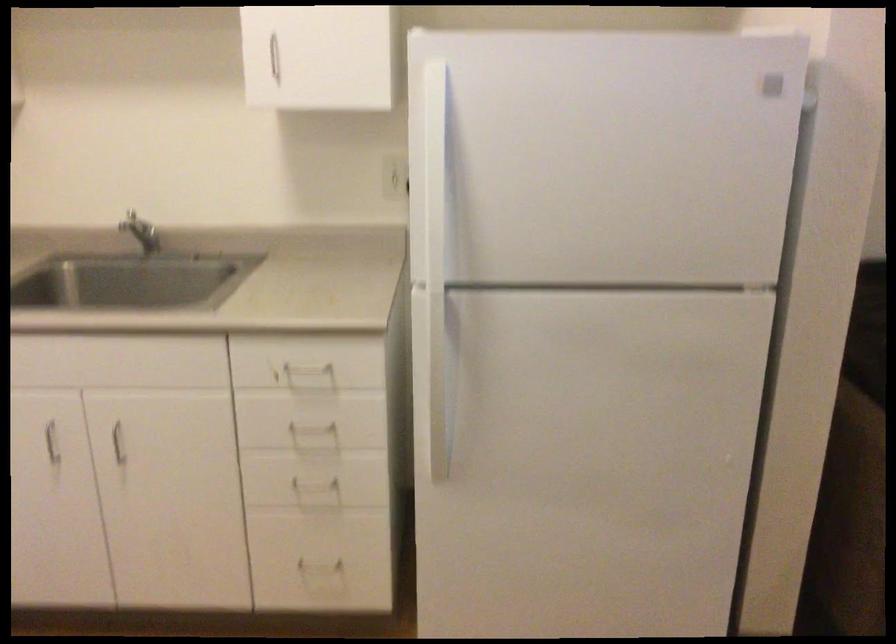
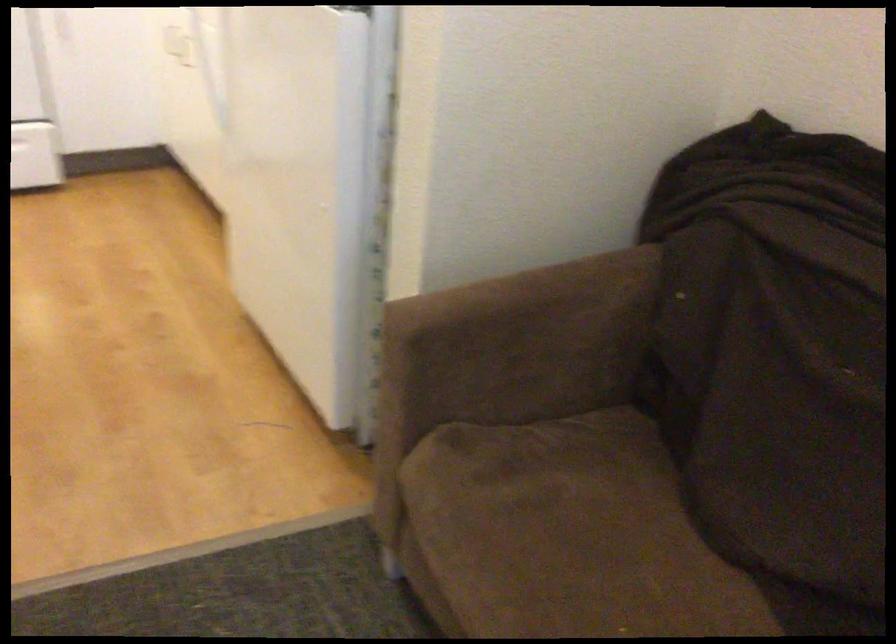
Question: I am providing you with two images of the same scene from different viewpoints. Please identify which objects are invisible in image2.

Choices:
 (A) white drawer handle
 (B) sofa sitting surface
 (C) brown sofa armrest
 (D) green stool

Answer: (A)